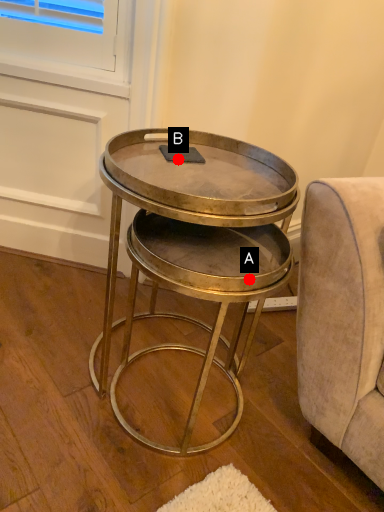
Question: Two points are circled on the image, labeled by A and B beside each circle. Which point appears farthest from the camera in this image?

Choices:
 (A) A is further
 (B) B is further

Answer: (B)